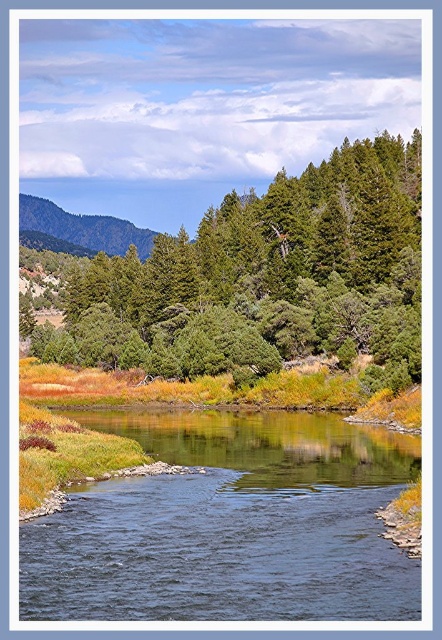
Is blue smooth water at center taller than green forested mountain at upper left?

No, blue smooth water at center is not taller than green forested mountain at upper left.

At what (x,y) coordinates should I click in order to perform the action: click on blue smooth water at center. Please return your answer as a coordinate pair (x, y). This screenshot has width=442, height=640. Looking at the image, I should click on tap(229, 525).

Locate an element on the screen. The width and height of the screenshot is (442, 640). blue smooth water at center is located at coordinates (229, 525).

Is blue smooth water at center smaller than green matte tree at upper center?

Yes, blue smooth water at center is smaller than green matte tree at upper center.

Based on the photo, who is positioned more to the left, blue smooth water at center or green matte tree at upper center?

Positioned to the left is blue smooth water at center.

Is point (342, 580) positioned after point (350, 307)?

That is False.

This screenshot has height=640, width=442. I want to click on blue smooth water at center, so click(229, 525).

Is green matte tree at upper center wider than green forested mountain at upper left?

Incorrect, green matte tree at upper center's width does not surpass green forested mountain at upper left's.

Is green matte tree at upper center bigger than green forested mountain at upper left?

Incorrect, green matte tree at upper center is not larger than green forested mountain at upper left.

Which is in front, point (82, 296) or point (149, 228)?

Point (82, 296) is more forward.

Locate an element on the screen. The width and height of the screenshot is (442, 640). green matte tree at upper center is located at coordinates (274, 273).